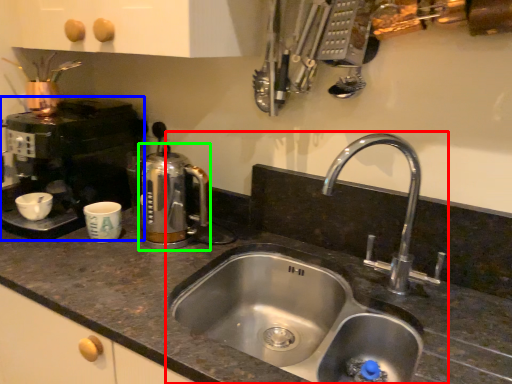
Question: Which object is the closest to the sink (highlighted by a red box)? Choose among these: coffee machine (highlighted by a blue box) or coffeepot (highlighted by a green box).

Choices:
 (A) coffee machine
 (B) coffeepot

Answer: (B)